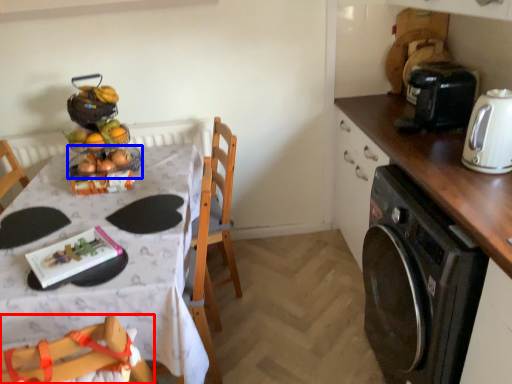
Question: Which object is closer to the camera taking this photo, chair (highlighted by a red box) or basket (highlighted by a blue box)?

Choices:
 (A) chair
 (B) basket

Answer: (A)